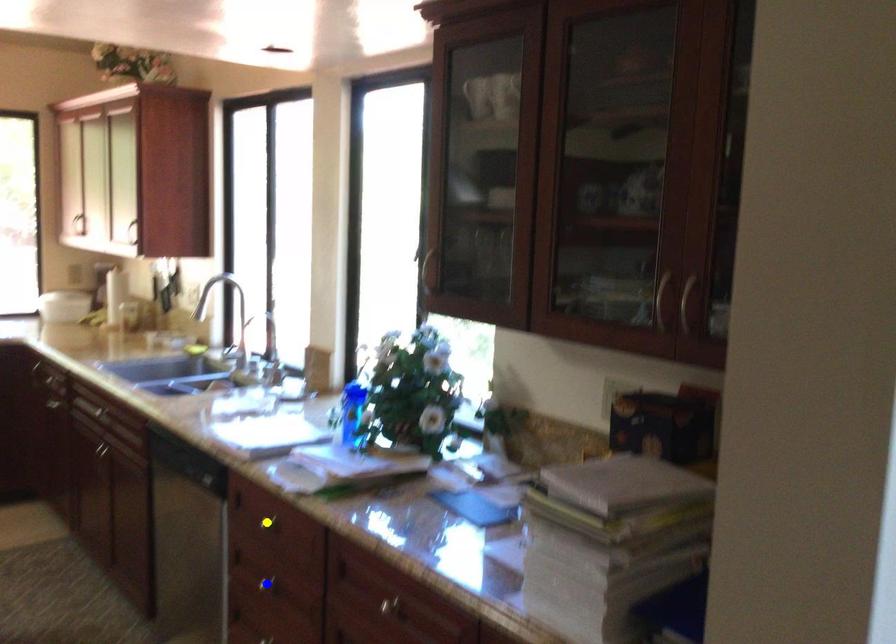
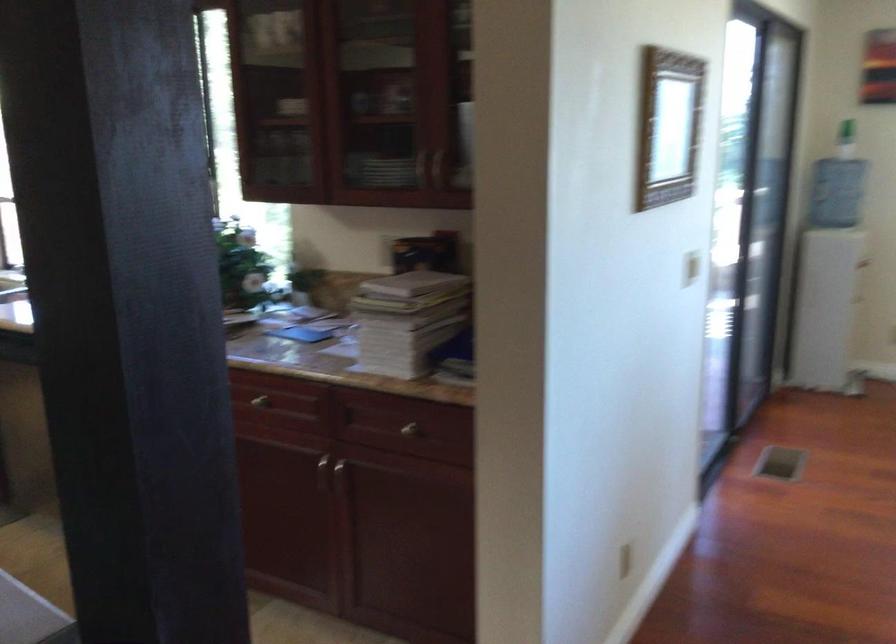
I am providing you with two images of the same scene from different viewpoints. Three points are marked in image1. Which point corresponds to a part or object that is occluded in image2?In image1, three points are marked. Which of them correspond to a part or object that is occluded in image2?Among the three points shown in image1, which one corresponds to a part or object that is no longer visible due to occlusion in image2?

blue point, green point, yellow point cannot be seen in image2.